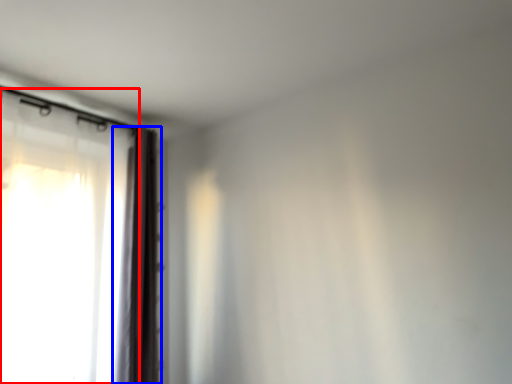
Question: Which point is further to the camera, curtain (highlighted by a red box) or curtain (highlighted by a blue box)?

Choices:
 (A) curtain
 (B) curtain

Answer: (B)